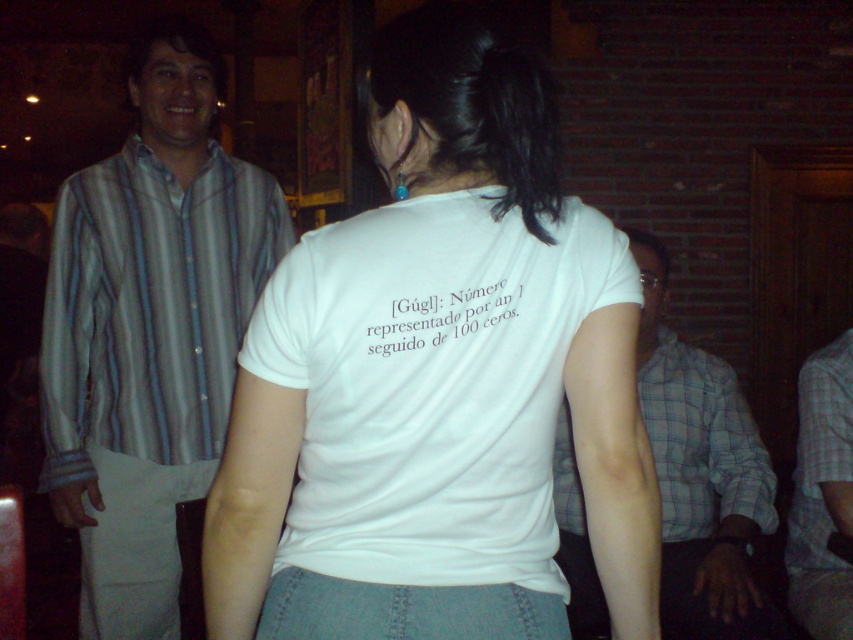
You are a photographer at the event and need to capture a photo that includes both the striped cotton shirt at left and the plaid cotton shirt at right. What is the minimum distance you need to move backward to ensure both shirts are in frame?

The striped cotton shirt at left is 3.36 feet from the plaid cotton shirt at right. To include both shirts in the frame, you need to move backward until the camera can capture a distance of at least 3.36 feet between them.

You are at a gathering and see two people wearing shirts. One is wearing a striped cotton shirt at left and the other a plaid cotton shirt at right. From your perspective, which shirt is positioned higher?

The striped cotton shirt at left is positioned higher than the plaid cotton shirt at right.